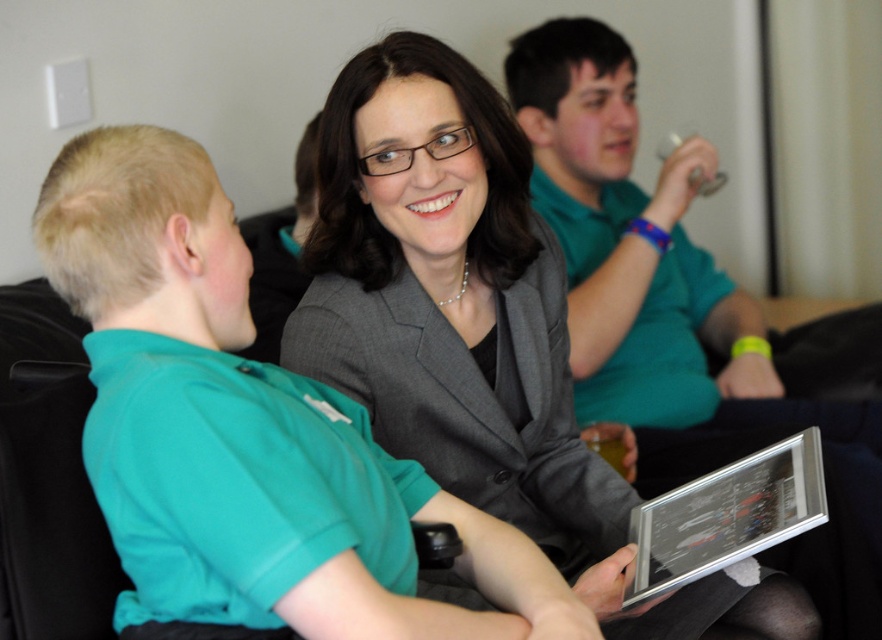
You are a photographer standing at the camera position. You want to adjust your position so that the matte gray blazer at center is closer to you. Which direction should you move?

Since the matte gray blazer at center and the camera are 3.70 feet apart, moving towards the matte gray blazer at center would bring it closer to you.

Based on the scene description, which object is shorter in height between the teal fabric shirt at left and the matte gray blazer at center?

The teal fabric shirt at left has a lesser height compared to the matte gray blazer at center, so the teal fabric shirt at left is shorter in height.

You are a photographer trying to capture a candid shot of the matte gray blazer at center and the silver metallic tablet at center. Which object should you focus on first if you want to ensure both are in the frame without moving the camera?

The matte gray blazer at center is located above the silver metallic tablet at center, so you should focus on the matte gray blazer at center first to ensure both are in the frame without moving the camera.